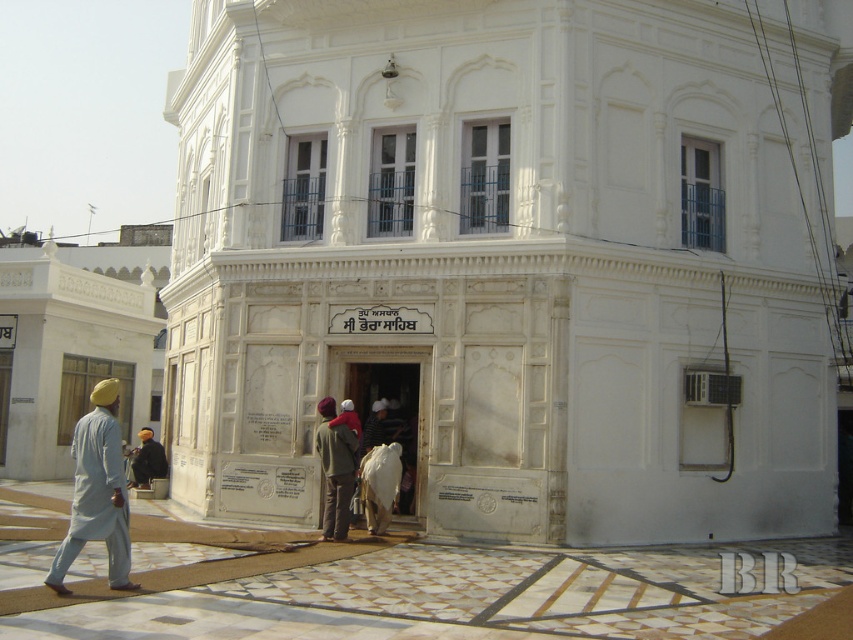
Question: Does light gray cotton kurta at left appear under light brown fabric jacket at center?

Choices:
 (A) no
 (B) yes

Answer: (A)

Question: Is light brown fabric jacket at center further to camera compared to dark blue fabric at lower left?

Choices:
 (A) yes
 (B) no

Answer: (B)

Question: Considering the real-world distances, which object is farthest from the dark blue fabric at lower left?

Choices:
 (A) light gray cotton kurta at left
 (B) light brown fabric jacket at center

Answer: (A)

Question: Which point appears closest to the camera in this image?

Choices:
 (A) (322, 406)
 (B) (76, 490)

Answer: (B)

Question: Which point is farther to the camera?

Choices:
 (A) dark blue fabric at lower left
 (B) light brown fabric jacket at center

Answer: (A)

Question: Can you confirm if light brown fabric jacket at center is bigger than dark blue fabric at lower left?

Choices:
 (A) no
 (B) yes

Answer: (B)